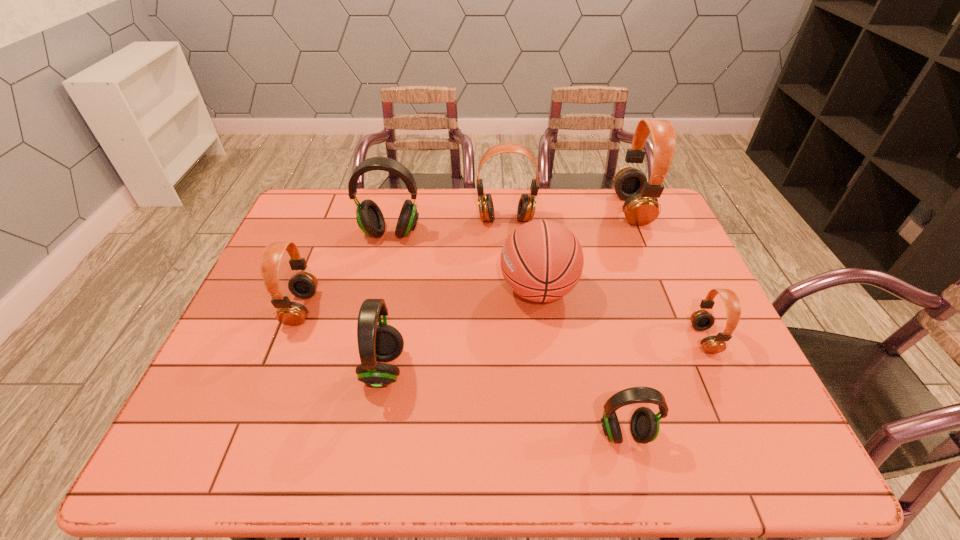
Find the location of a particular element. vacant space at the left edge of the desktop is located at coordinates pos(234,407).

In the image, there is a desktop. At what (x,y) coordinates should I click in order to perform the action: click on vacant space at the right edge. Please return your answer as a coordinate pair (x, y). Image resolution: width=960 pixels, height=540 pixels. Looking at the image, I should click on (699, 299).

Image resolution: width=960 pixels, height=540 pixels. What are the coordinates of `free location at the far left corner` in the screenshot? It's located at (308, 208).

The width and height of the screenshot is (960, 540). In the image, there is a desktop. In order to click on free space at the far right corner in this screenshot , I will do `click(661, 207)`.

Where is `vacant region between the second farthest black headset and the smallest brown headset`? This screenshot has height=540, width=960. vacant region between the second farthest black headset and the smallest brown headset is located at coordinates (543, 354).

At what (x,y) coordinates should I click in order to perform the action: click on free area in between the second farthest black headset and the nearest headset. Please return your answer as a coordinate pair (x, y). Image resolution: width=960 pixels, height=540 pixels. Looking at the image, I should click on (504, 401).

Locate an element on the screen. The width and height of the screenshot is (960, 540). free area in between the nearest object and the smallest brown headset is located at coordinates (664, 386).

I want to click on free space between the leftmost headset and the nearest black headset, so click(463, 370).

At what (x,y) coordinates should I click in order to perform the action: click on free spot between the leftmost brown headset and the fourth headset from right to left. Please return your answer as a coordinate pair (x, y). Looking at the image, I should click on (403, 264).

Locate an element on the screen. This screenshot has width=960, height=540. free space between the smallest brown headset and the third smallest brown headset is located at coordinates (605, 279).